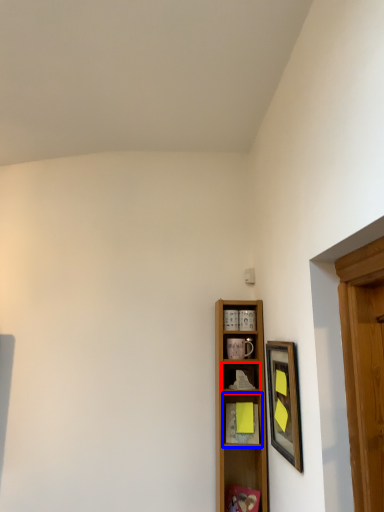
Question: Which point is further to the camera, shelf (highlighted by a red box) or shelf (highlighted by a blue box)?

Choices:
 (A) shelf
 (B) shelf

Answer: (A)